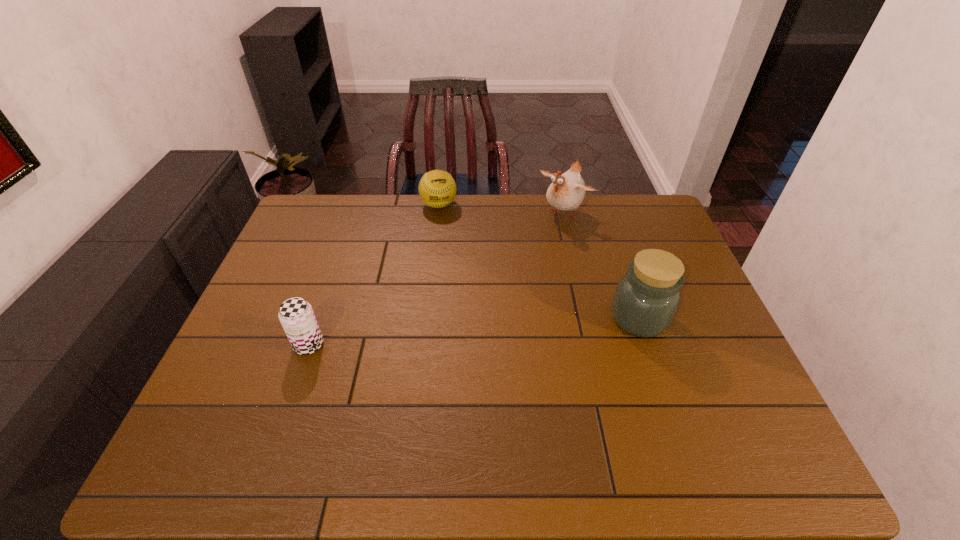
The image size is (960, 540). What are the coordinates of `free area in between the jar and the leftmost object` in the screenshot? It's located at [x=474, y=332].

Find the location of a particular element. The image size is (960, 540). vacant point located between the beer can and the jar is located at coordinates (474, 332).

Locate which object is the second closest to the bird. Please provide its 2D coordinates. Your answer should be formatted as a tuple, i.e. [(x, y)], where the tuple contains the x and y coordinates of a point satisfying the conditions above.

[(647, 297)]

In order to click on object that is the closest to the jar in this screenshot , I will do `click(566, 192)`.

Identify the location of free space in the image that satisfies the following two spatial constraints: 1. on the back side of the second object from left to right; 2. on the left side of the leftmost object. (357, 205).

You are a GUI agent. You are given a task and a screenshot of the screen. Output one action in this format:
    pyautogui.click(x=<x>, y=<y>)
    Task: Click on the vacant area that satisfies the following two spatial constraints: 1. on the back side of the jar; 2. on the right side of the leftmost object
    
    Given the screenshot: What is the action you would take?
    pyautogui.click(x=319, y=318)

Locate an element on the screen. The height and width of the screenshot is (540, 960). vacant point that satisfies the following two spatial constraints: 1. on the back side of the jar; 2. on the right side of the beer can is located at coordinates (319, 318).

Where is `vacant space that satisfies the following two spatial constraints: 1. on the front side of the bird; 2. on the right side of the jar`? vacant space that satisfies the following two spatial constraints: 1. on the front side of the bird; 2. on the right side of the jar is located at coordinates (589, 318).